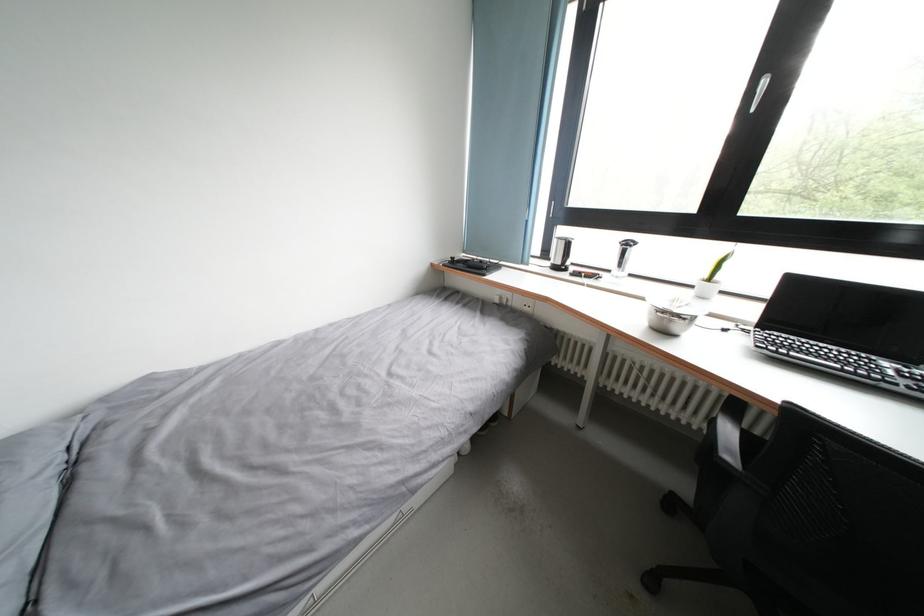
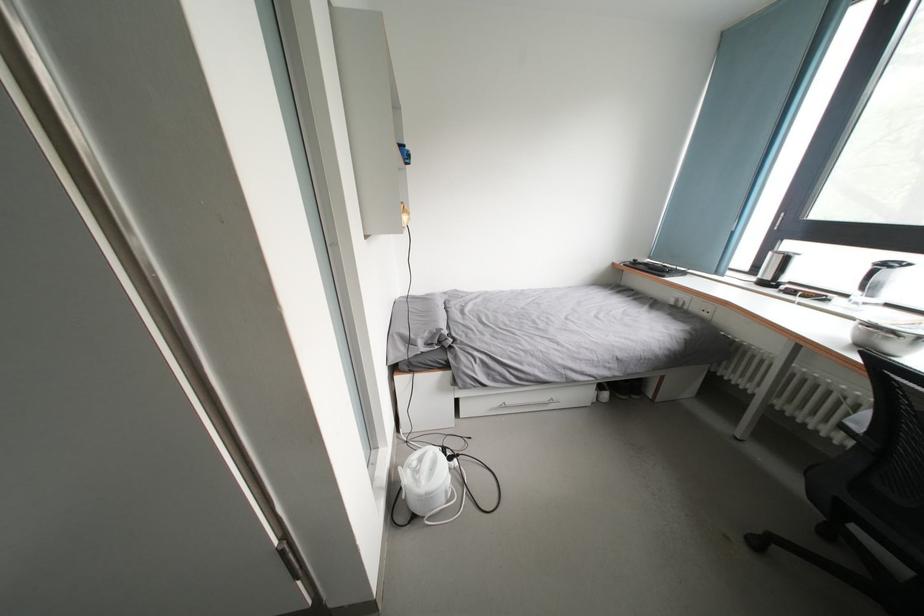
In the second image, find the point that corresponds to pixel 670 317 in the first image.

(877, 331)